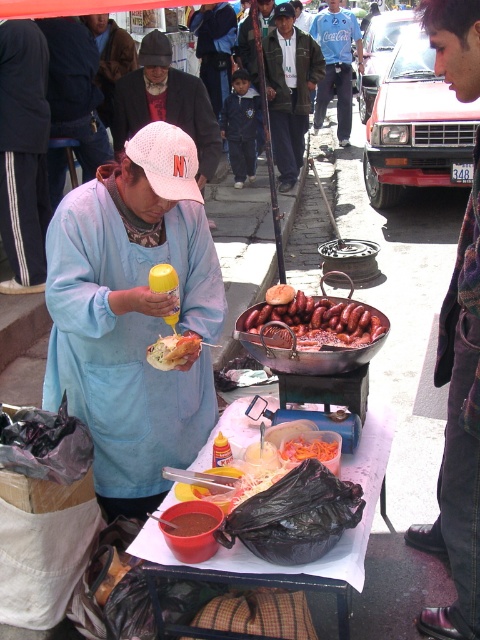
Question: Considering the relative positions of dark green jacket at center and sausageglazedatcenter in the image provided, where is dark green jacket at center located with respect to sausageglazedatcenter?

Choices:
 (A) above
 (B) below

Answer: (A)

Question: Based on their relative distances, which object is farther from the white paper table at center?

Choices:
 (A) dark brown leather jacket at lower right
 (B) matte blue apron at center
 (C) knitted wool cap at center

Answer: (C)

Question: Which is farther from the knitted wool cap at center?

Choices:
 (A) white paper table at center
 (B) sausageglazedatcenter

Answer: (A)

Question: Is blue cotton shirt at center thinner than golden crispy bread at center?

Choices:
 (A) yes
 (B) no

Answer: (B)

Question: Is sausageglazedatcenter below carrot shredded at center?

Choices:
 (A) no
 (B) yes

Answer: (A)

Question: Which point is farther to the camera?

Choices:
 (A) golden crispy bread at center
 (B) knitted wool cap at center
 (C) thick brown paste at center
 (D) sausageglazedatcenter

Answer: (B)